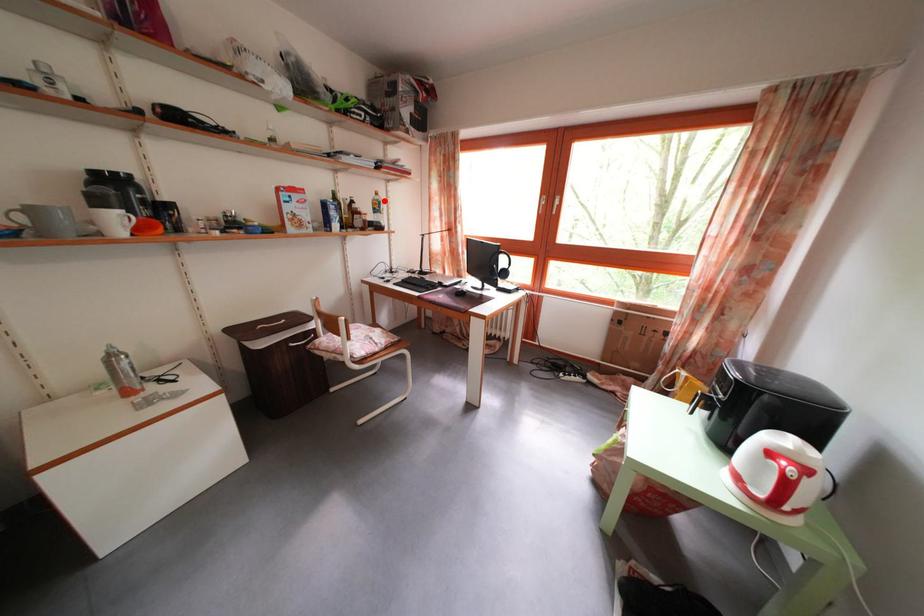
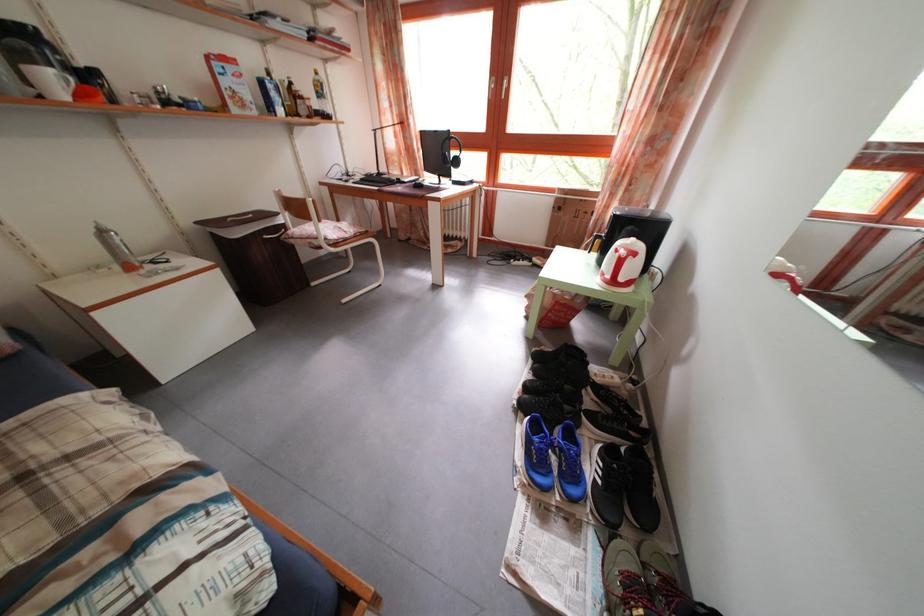
Where in the second image is the point corresponding to the highlighted location from the first image?

(323, 79)